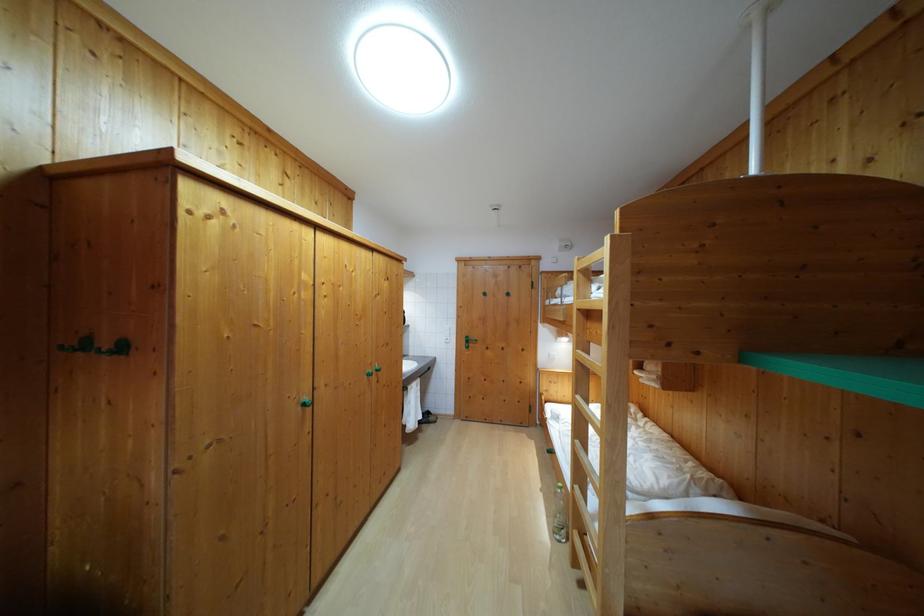
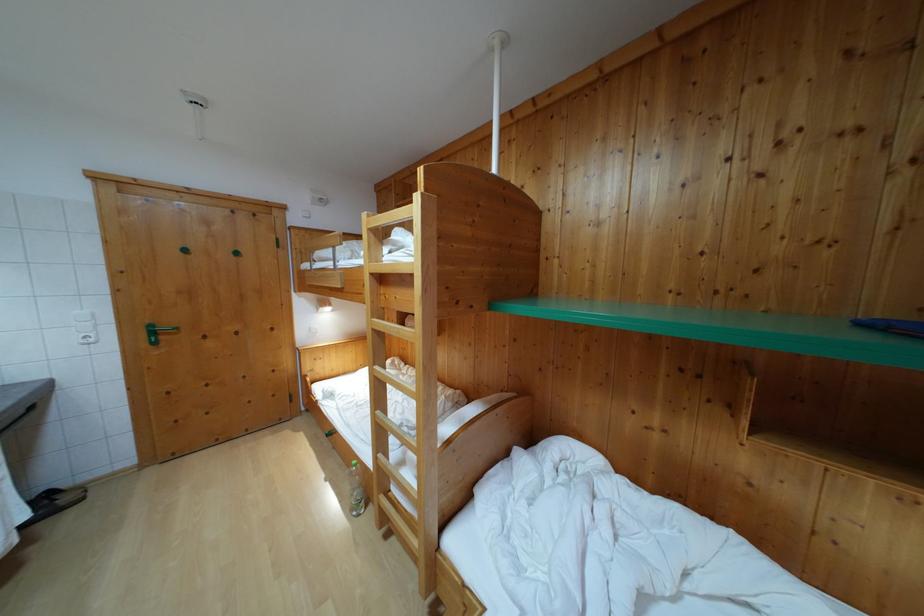
The point at (564, 496) is marked in the first image. Where is the corresponding point in the second image?

(359, 472)